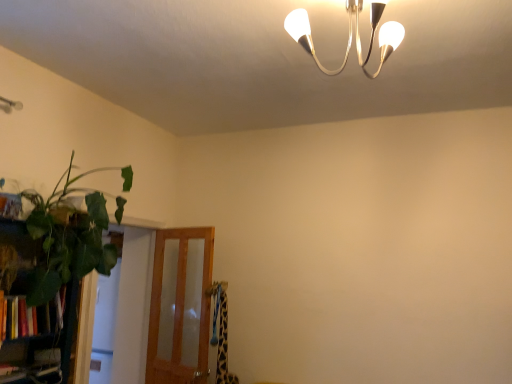
Question: Could you tell me if translucent wood screen door at lower left is turned towards hardcover books at left?

Choices:
 (A) yes
 (B) no

Answer: (A)

Question: Is translucent wood screen door at lower left positioned beyond the bounds of hardcover books at left?

Choices:
 (A) no
 (B) yes

Answer: (B)

Question: Is translucent wood screen door at lower left taller than hardcover books at left?

Choices:
 (A) yes
 (B) no

Answer: (A)

Question: Considering the relative sizes of translucent wood screen door at lower left and hardcover books at left in the image provided, is translucent wood screen door at lower left smaller than hardcover books at left?

Choices:
 (A) no
 (B) yes

Answer: (A)

Question: From a real-world perspective, is translucent wood screen door at lower left physically below hardcover books at left?

Choices:
 (A) yes
 (B) no

Answer: (A)

Question: Is hardcover books at left surrounded by translucent wood screen door at lower left?

Choices:
 (A) no
 (B) yes

Answer: (A)

Question: Can you confirm if green leafy plant at left is bigger than hardcover books at left?

Choices:
 (A) no
 (B) yes

Answer: (B)

Question: Is green leafy plant at left closer to camera compared to hardcover books at left?

Choices:
 (A) yes
 (B) no

Answer: (A)

Question: Does green leafy plant at left turn towards hardcover books at left?

Choices:
 (A) no
 (B) yes

Answer: (A)

Question: Considering the relative positions of green leafy plant at left and hardcover books at left in the image provided, is green leafy plant at left behind hardcover books at left?

Choices:
 (A) no
 (B) yes

Answer: (A)

Question: From the image's perspective, would you say green leafy plant at left is shown under hardcover books at left?

Choices:
 (A) yes
 (B) no

Answer: (B)

Question: Can you confirm if green leafy plant at left is thinner than hardcover books at left?

Choices:
 (A) yes
 (B) no

Answer: (B)

Question: From a real-world perspective, is hardcover books at left under translucent wood screen door at lower left?

Choices:
 (A) yes
 (B) no

Answer: (B)